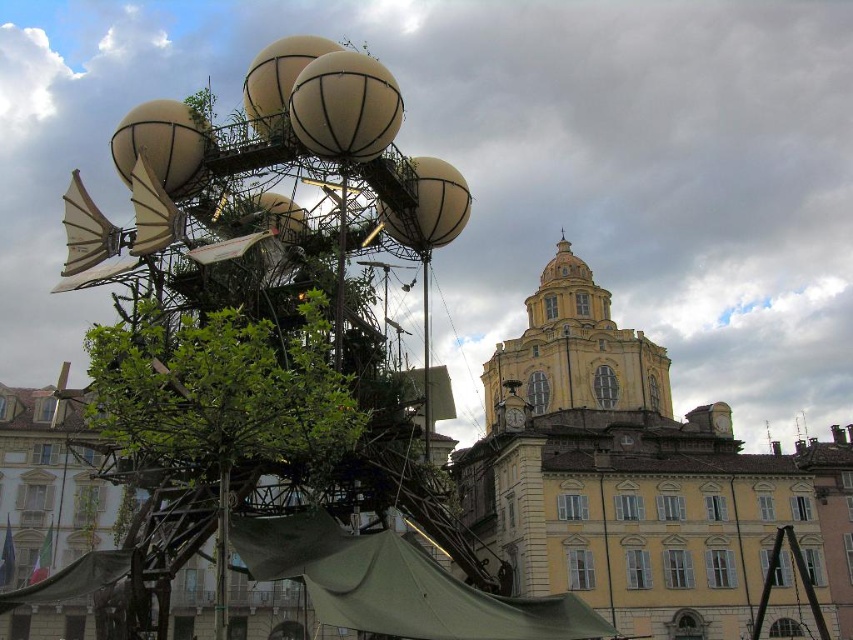
Is green canvas canopy at lower center further to the viewer compared to yellow matte tower at upper center?

No, green canvas canopy at lower center is closer to the viewer.

Who is taller, green canvas canopy at lower center or yellow matte tower at upper center?

With more height is yellow matte tower at upper center.

Is point (404, 621) more distant than point (663, 412)?

No, (404, 621) is closer to viewer.

Identify the location of green canvas canopy at lower center. This screenshot has height=640, width=853. (396, 584).

Which is behind, point (154, 440) or point (312, 572)?

The point (154, 440) is more distant.

Does green leafy tree at center have a lesser height compared to green canvas canopy at lower center?

No.

Where is `green leafy tree at center`? The height and width of the screenshot is (640, 853). green leafy tree at center is located at coordinates (213, 422).

Between green canvas canopy at lower center and green canvas canopy at lower left, which one appears on the left side from the viewer's perspective?

green canvas canopy at lower left

Between point (248, 532) and point (79, 580), which one is positioned in front?

Positioned in front is point (79, 580).

You are a GUI agent. You are given a task and a screenshot of the screen. Output one action in this format:
    pyautogui.click(x=<x>, y=<y>)
    Task: Click on the green canvas canopy at lower center
    This screenshot has height=640, width=853.
    Given the screenshot: What is the action you would take?
    point(396,584)